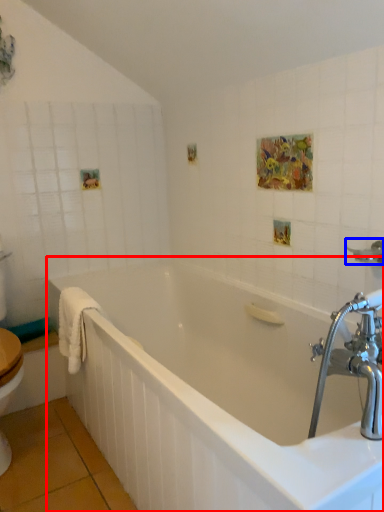
Question: Which object is closer to the camera taking this photo, bathtub (highlighted by a red box) or shower (highlighted by a blue box)?

Choices:
 (A) bathtub
 (B) shower

Answer: (A)